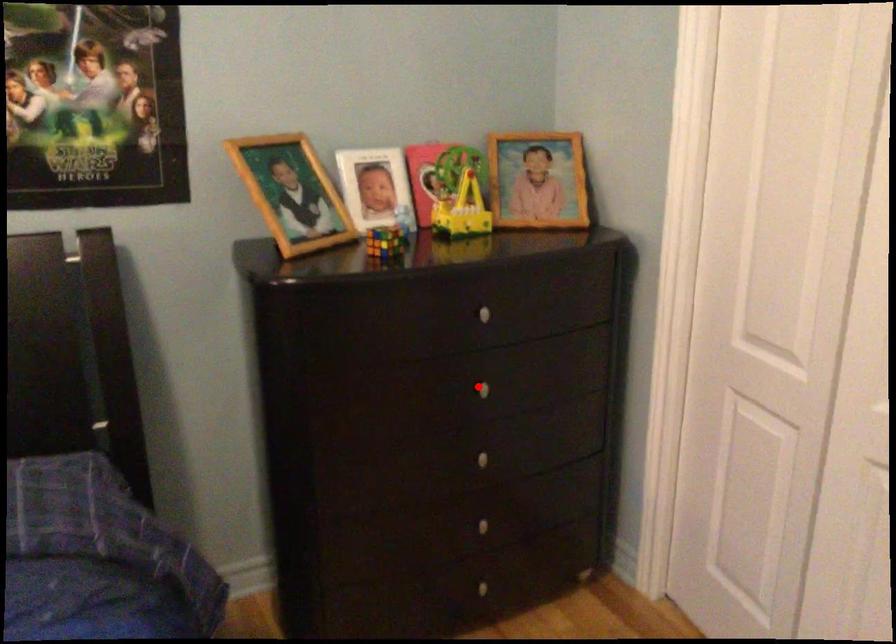
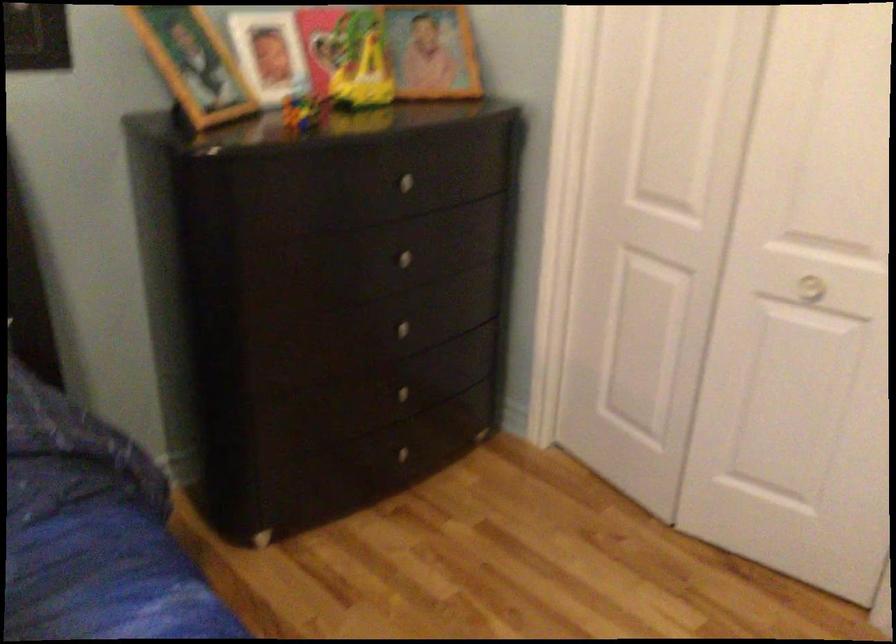
In the second image, find the point that corresponds to the highlighted location in the first image.

(399, 258)